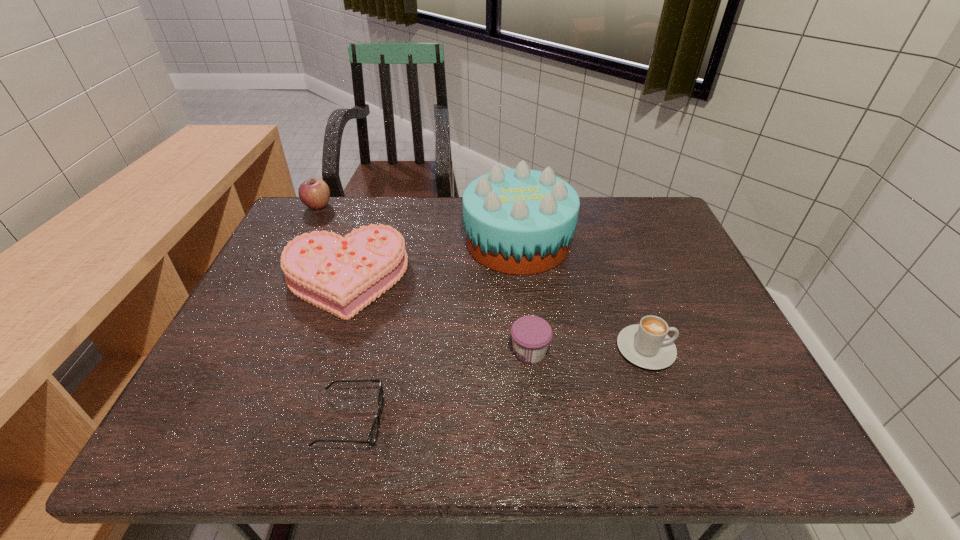
Identify the location of cake that is at the left edge. (342, 275).

This screenshot has height=540, width=960. I want to click on object positioned at the right edge, so click(x=647, y=345).

Locate an element on the screen. object that is at the far left corner is located at coordinates (314, 193).

What are the coordinates of `blank area at the far edge` in the screenshot? It's located at (365, 200).

In the image, there is a desktop. At what (x,y) coordinates should I click in order to perform the action: click on vacant area at the near edge. Please return your answer as a coordinate pair (x, y). Looking at the image, I should click on (686, 449).

What are the coordinates of `vacant region at the left edge of the desktop` in the screenshot? It's located at (252, 383).

This screenshot has width=960, height=540. In order to click on free space at the right edge of the desktop in this screenshot , I will do `click(709, 294)`.

Image resolution: width=960 pixels, height=540 pixels. Find the location of `free space at the near left corner of the desktop`. free space at the near left corner of the desktop is located at coordinates (172, 447).

This screenshot has width=960, height=540. I want to click on free space at the far right corner of the desktop, so click(636, 235).

Find the location of a particular element. The width and height of the screenshot is (960, 540). empty space between the nearest object and the left cake is located at coordinates (348, 349).